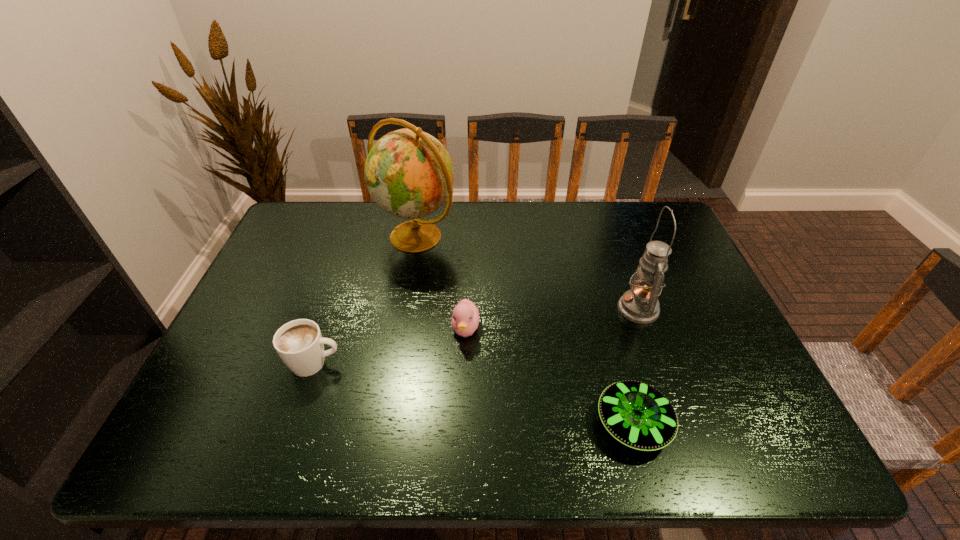
Find the location of a particular element. The height and width of the screenshot is (540, 960). object that is the closest one to the second tallest object is located at coordinates (638, 415).

Locate an element on the screen. The image size is (960, 540). vacant position in the image that satisfies the following two spatial constraints: 1. on the back side of the saucer; 2. with the handle on the side of the fourth farthest object is located at coordinates (616, 363).

Identify the location of free location that satisfies the following two spatial constraints: 1. on the front-facing side of the third object from right to left; 2. on the left side of the shortest object. The image size is (960, 540). (463, 423).

Locate an element on the screen. The width and height of the screenshot is (960, 540). vacant area in the image that satisfies the following two spatial constraints: 1. on the front-facing side of the third object from left to right; 2. with the handle on the side of the fourth farthest object is located at coordinates (465, 363).

The width and height of the screenshot is (960, 540). I want to click on vacant region that satisfies the following two spatial constraints: 1. on the front side of the fourth shortest object; 2. with the handle on the side of the cappuccino, so [x=658, y=363].

I want to click on free spot that satisfies the following two spatial constraints: 1. on the front side of the tallest object; 2. with the handle on the side of the fourth farthest object, so click(x=395, y=363).

Where is `vacant space that satisfies the following two spatial constraints: 1. on the front-facing side of the duckling; 2. with the handle on the side of the fourth farthest object`? vacant space that satisfies the following two spatial constraints: 1. on the front-facing side of the duckling; 2. with the handle on the side of the fourth farthest object is located at coordinates (465, 363).